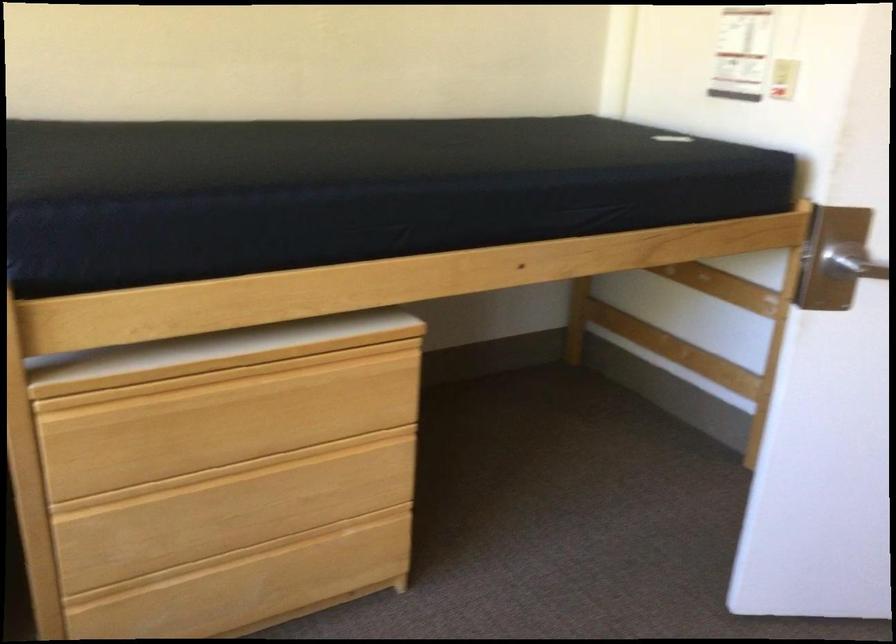
Where is `metal door knob`? Image resolution: width=896 pixels, height=644 pixels. metal door knob is located at coordinates (851, 261).